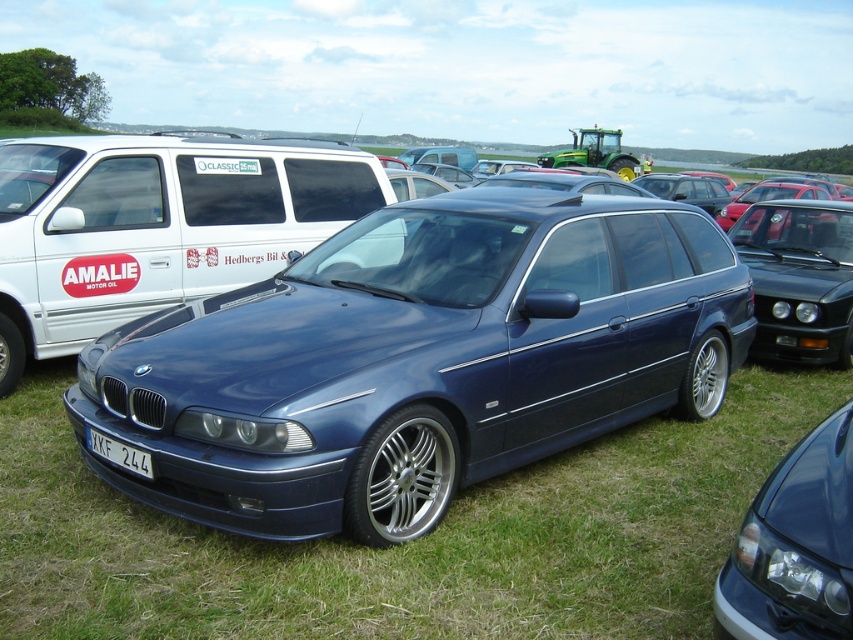
Does white matte van at center appear on the right side of satin black car at center?

Incorrect, white matte van at center is not on the right side of satin black car at center.

Between point (190, 200) and point (759, 552), which one is positioned in front?

Point (759, 552) is in front.

You are a GUI agent. You are given a task and a screenshot of the screen. Output one action in this format:
    pyautogui.click(x=<x>, y=<y>)
    Task: Click on the white matte van at center
    
    Given the screenshot: What is the action you would take?
    pos(155,225)

How far apart are blue metallic car at center and white matte van at center?

A distance of 3.39 meters exists between blue metallic car at center and white matte van at center.

Between blue metallic car at center and white matte van at center, which one has more height?

white matte van at center is taller.

Find the location of a particular element. blue metallic car at center is located at coordinates (407, 544).

Can you confirm if satin black sedan at right is taller than white plastic license plate at lower center?

Yes.

Who is lower down, satin black sedan at right or white plastic license plate at lower center?

white plastic license plate at lower center is below.

Measure the distance between satin black sedan at right and camera.

A distance of 7.32 meters exists between satin black sedan at right and camera.

Image resolution: width=853 pixels, height=640 pixels. I want to click on satin black sedan at right, so click(799, 278).